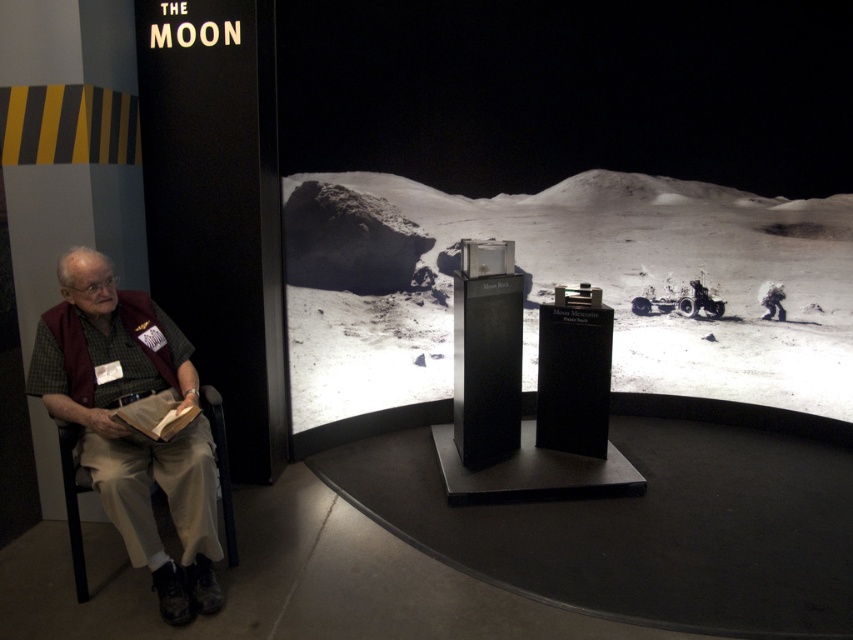
Is beige fabric pants at left taller than brown paper book at lower left?

Indeed, beige fabric pants at left has a greater height compared to brown paper book at lower left.

Between point (96, 291) and point (177, 420), which one is positioned behind?

Positioned behind is point (96, 291).

This screenshot has width=853, height=640. Identify the location of beige fabric pants at left. (131, 426).